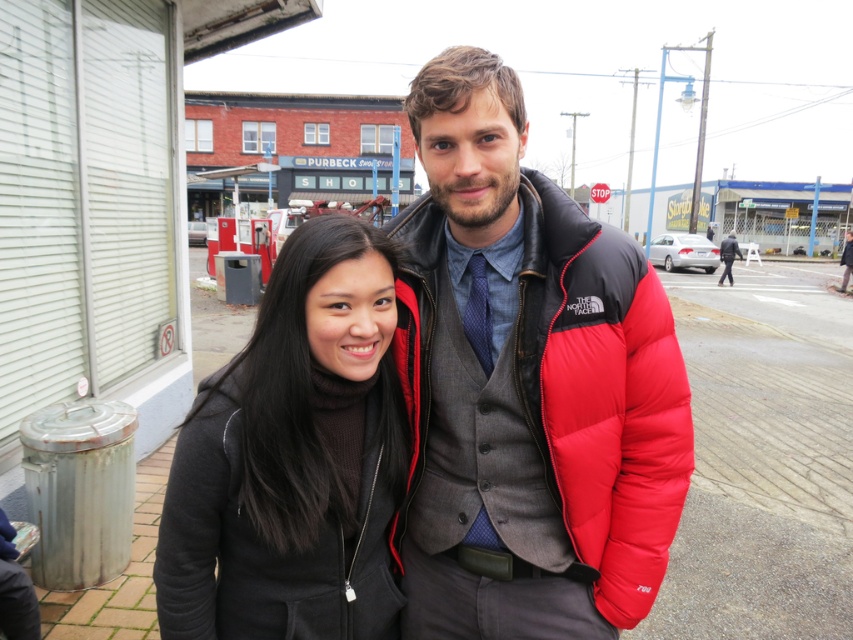
Does black matte jacket at center have a smaller size compared to dark gray wool coat at center?

Yes.

From the picture: Is the position of black matte jacket at center less distant than that of dark gray wool coat at center?

That is True.

In order to click on black matte jacket at center in this screenshot , I will do `click(291, 461)`.

Which is more to the left, matte black jacket at center or dark gray wool coat at center?

matte black jacket at center

In order to click on matte black jacket at center in this screenshot , I will do `click(526, 385)`.

Does red puffer jacket at center have a smaller size compared to dark gray wool coat at center?

Correct, red puffer jacket at center occupies less space than dark gray wool coat at center.

Where is `red puffer jacket at center`? The image size is (853, 640). red puffer jacket at center is located at coordinates (602, 394).